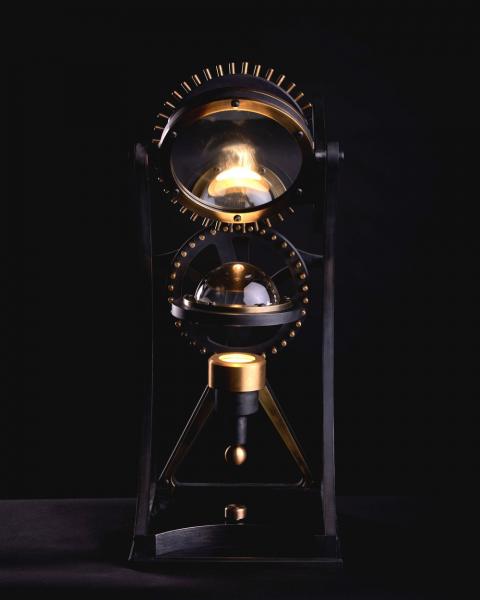
Locate an element on the screen. The width and height of the screenshot is (480, 600). empty table space is located at coordinates (94, 524).